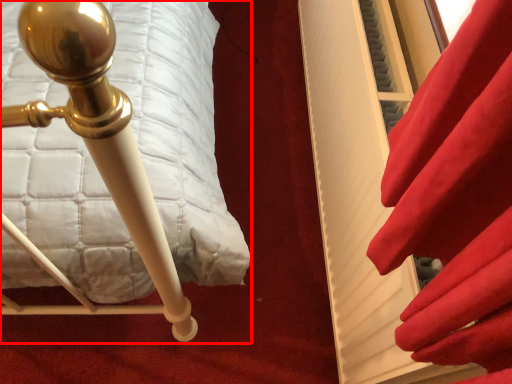
Question: In this image, where is furniture (annotated by the red box) located relative to curtain?

Choices:
 (A) right
 (B) left

Answer: (B)